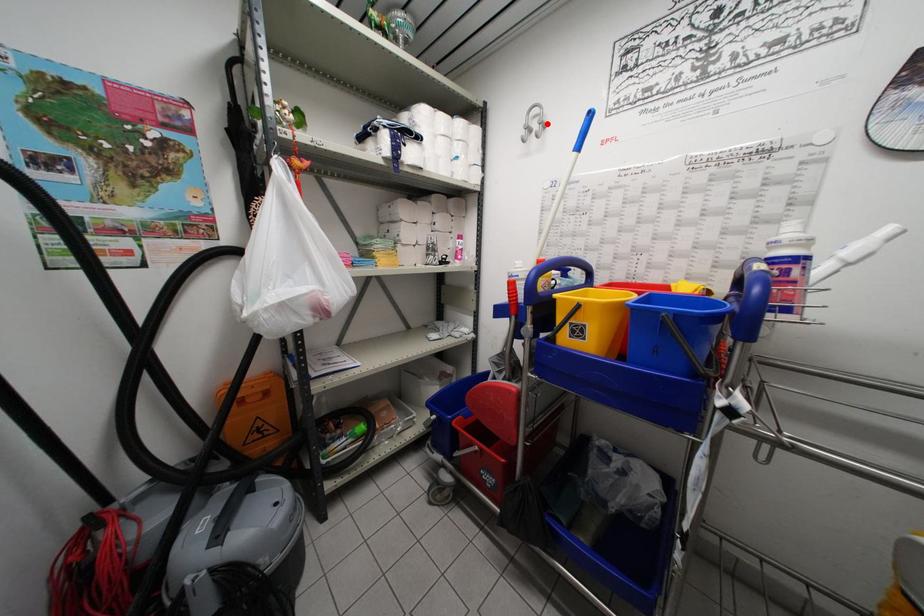
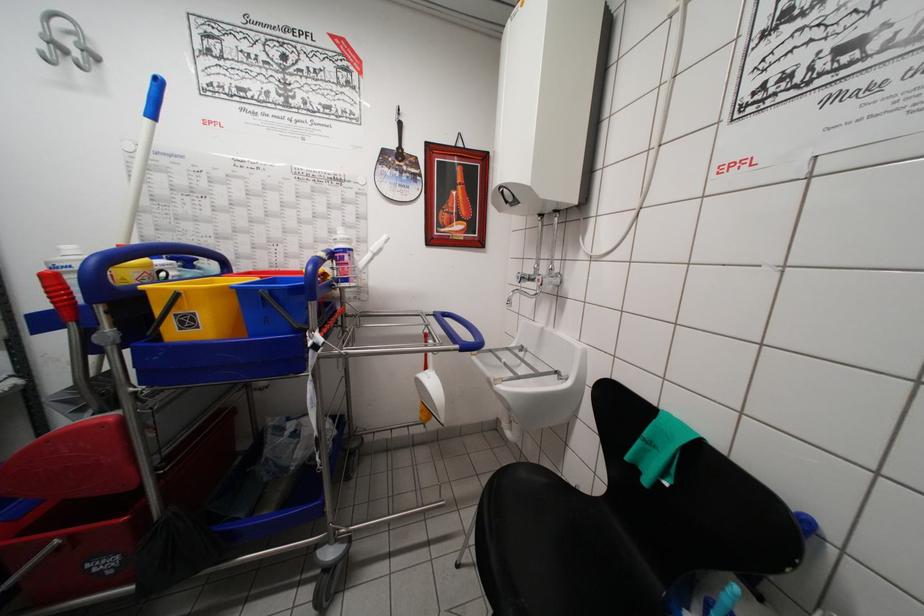
Question: I am providing you with two images of the same scene from different viewpoints. A red point is marked on the first image. At the location where the point appears in image 1, is it still visible in image 2?

Choices:
 (A) Yes
 (B) No

Answer: (A)